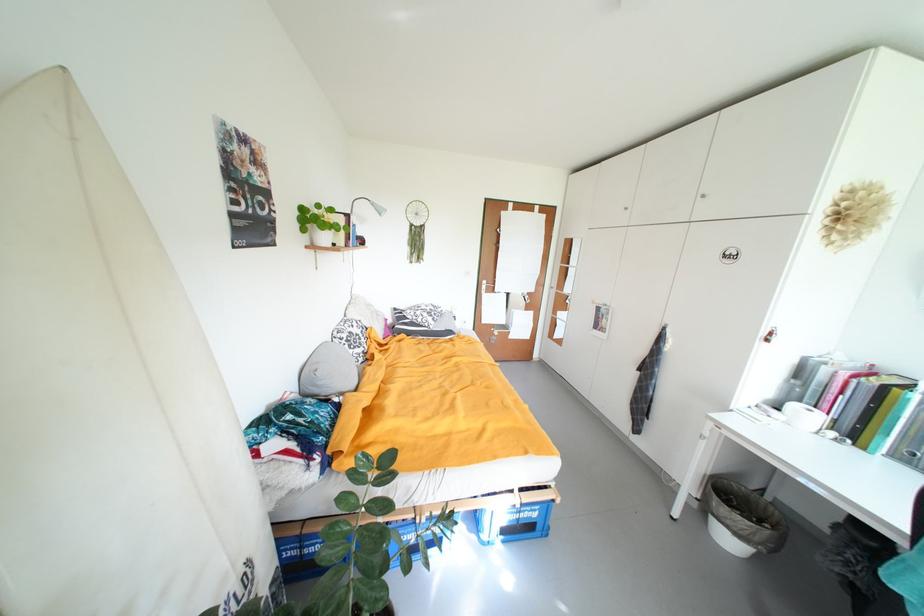
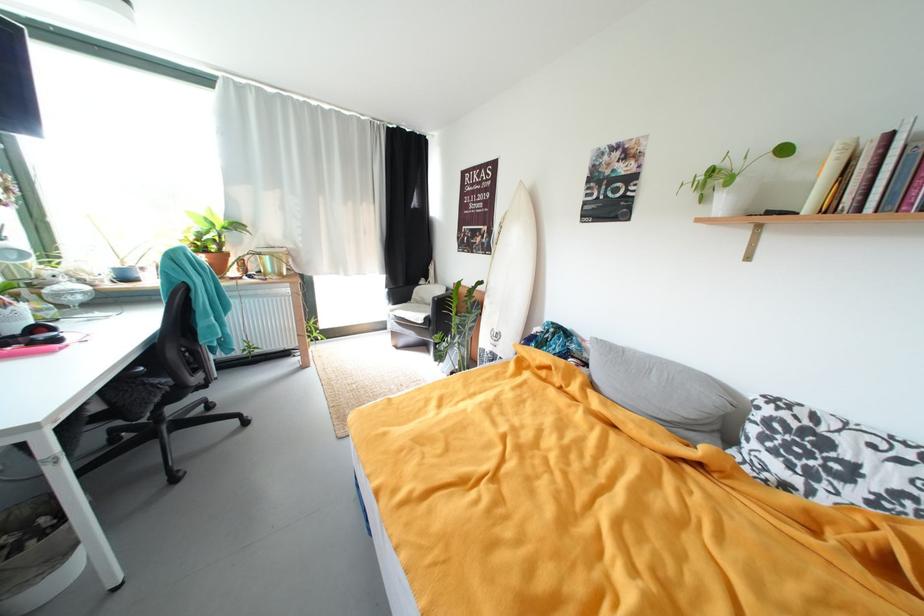
Find the pixel in the second image that matches point (371, 341) in the first image.

(861, 493)